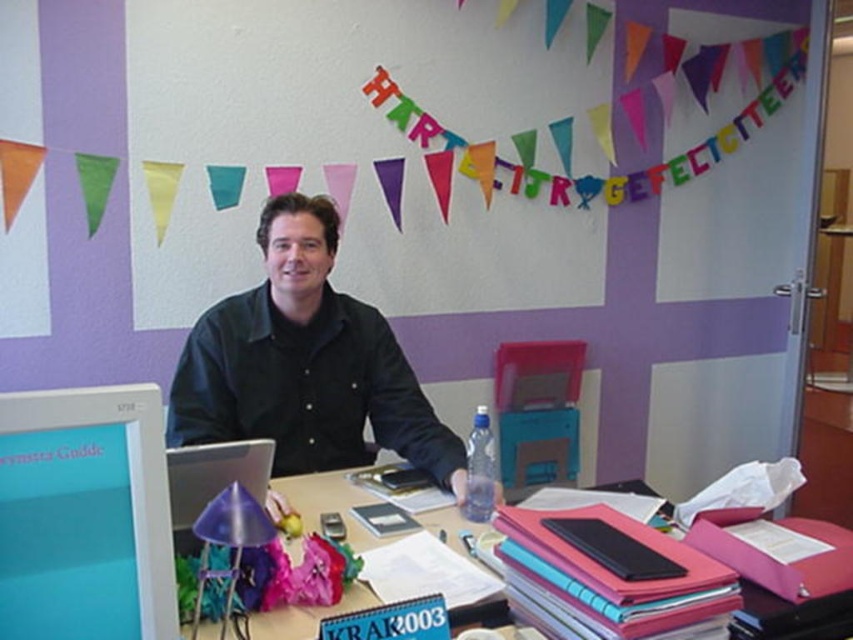
Between black matte shirt at center and matte plastic computer monitor at left, which one is positioned higher?

black matte shirt at center is higher up.

Is black matte shirt at center below matte plastic computer monitor at left?

Incorrect, black matte shirt at center is not positioned below matte plastic computer monitor at left.

Who is more forward, (393, 404) or (38, 470)?

Positioned in front is point (38, 470).

This screenshot has height=640, width=853. I want to click on black matte shirt at center, so click(305, 364).

Is point (300, 294) closer to camera compared to point (373, 518)?

No, (300, 294) is further to viewer.

Which is in front, point (390, 408) or point (838, 570)?

Point (838, 570)

You are a GUI agent. You are given a task and a screenshot of the screen. Output one action in this format:
    pyautogui.click(x=<x>, y=<y>)
    Task: Click on the black matte shirt at center
    The width and height of the screenshot is (853, 640).
    Given the screenshot: What is the action you would take?
    pyautogui.click(x=305, y=364)

Identify the location of black matte shirt at center. This screenshot has width=853, height=640. (305, 364).

Measure the distance between matte plastic computer monitor at left and pink plastic folders at center.

matte plastic computer monitor at left and pink plastic folders at center are 1.03 meters apart from each other.

Does point (148, 628) come closer to viewer compared to point (720, 499)?

That is True.

Identify the location of matte plastic computer monitor at left. This screenshot has width=853, height=640. (84, 515).